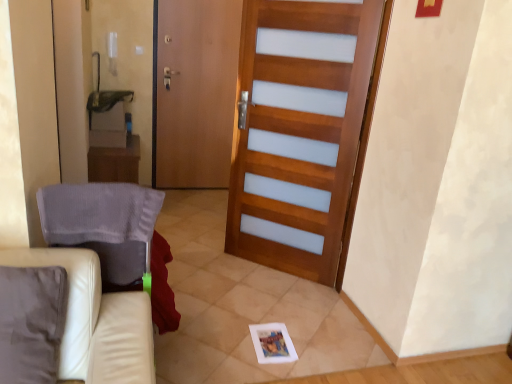
Question: Does point (55, 218) appear closer or farther from the camera than point (284, 77)?

Choices:
 (A) closer
 (B) farther

Answer: (A)

Question: Based on their sizes in the image, would you say gray fabric armchair at left is bigger or smaller than wooden barn door at center?

Choices:
 (A) small
 (B) big

Answer: (A)

Question: Which is farther from the wooden barn door at center?

Choices:
 (A) wooden screen door at center
 (B) wooden table at left
 (C) gray fabric armchair at left
 (D) white leather couch at lower left

Answer: (D)

Question: Which of these objects is positioned closest to the white leather couch at lower left?

Choices:
 (A) wooden table at left
 (B) wooden barn door at center
 (C) wooden screen door at center
 (D) gray fabric armchair at left

Answer: (D)